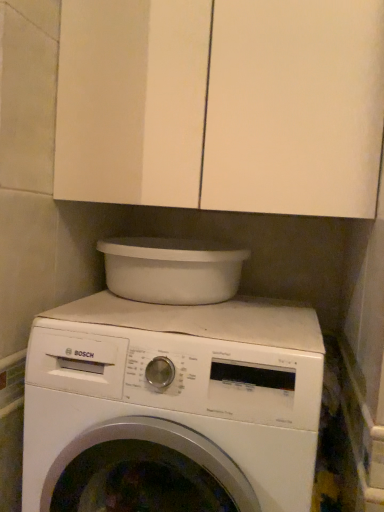
Question: Is white matte cabinet at upper center far away from white matte washing machine at center?

Choices:
 (A) no
 (B) yes

Answer: (A)

Question: Considering the relative sizes of white matte cabinet at upper center and white matte washing machine at center in the image provided, is white matte cabinet at upper center taller than white matte washing machine at center?

Choices:
 (A) no
 (B) yes

Answer: (A)

Question: Are white matte cabinet at upper center and white matte washing machine at center making contact?

Choices:
 (A) yes
 (B) no

Answer: (B)

Question: Considering the relative sizes of white matte cabinet at upper center and white matte washing machine at center in the image provided, is white matte cabinet at upper center wider than white matte washing machine at center?

Choices:
 (A) no
 (B) yes

Answer: (A)

Question: Does white matte cabinet at upper center lie behind white matte washing machine at center?

Choices:
 (A) yes
 (B) no

Answer: (A)

Question: Would you say white matte cabinet at upper center contains white matte washing machine at center?

Choices:
 (A) yes
 (B) no

Answer: (B)

Question: Is white matte cabinet at upper center inside white matte washing machine at center?

Choices:
 (A) yes
 (B) no

Answer: (B)

Question: Can you confirm if white matte washing machine at center is positioned to the right of white matte cabinet at upper center?

Choices:
 (A) yes
 (B) no

Answer: (B)

Question: Considering the relative sizes of white matte washing machine at center and white matte cabinet at upper center in the image provided, is white matte washing machine at center thinner than white matte cabinet at upper center?

Choices:
 (A) yes
 (B) no

Answer: (B)

Question: From a real-world perspective, is white matte washing machine at center positioned under white matte cabinet at upper center based on gravity?

Choices:
 (A) yes
 (B) no

Answer: (A)

Question: Is white matte washing machine at center aimed at white matte cabinet at upper center?

Choices:
 (A) yes
 (B) no

Answer: (B)

Question: Is white matte washing machine at center outside white matte cabinet at upper center?

Choices:
 (A) yes
 (B) no

Answer: (A)

Question: Is there a large distance between white plastic basin at upper center and white matte washing machine at center?

Choices:
 (A) yes
 (B) no

Answer: (B)